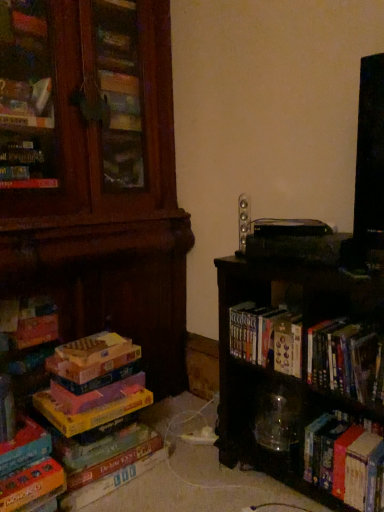
Question: Is black matte bookshelf at right positioned beyond the bounds of satin silver speaker at upper center?

Choices:
 (A) no
 (B) yes

Answer: (B)

Question: Is the position of black matte bookshelf at right less distant than that of satin silver speaker at upper center?

Choices:
 (A) no
 (B) yes

Answer: (B)

Question: Is black matte bookshelf at right facing towards satin silver speaker at upper center?

Choices:
 (A) yes
 (B) no

Answer: (B)

Question: From the image's perspective, does black matte bookshelf at right appear higher than satin silver speaker at upper center?

Choices:
 (A) no
 (B) yes

Answer: (A)

Question: Is black matte bookshelf at right oriented away from satin silver speaker at upper center?

Choices:
 (A) no
 (B) yes

Answer: (A)

Question: Is black matte bookshelf at right to the left of satin silver speaker at upper center from the viewer's perspective?

Choices:
 (A) yes
 (B) no

Answer: (B)

Question: Does hardcover books at center, arranged as the third book when viewed from the right, appear on the left side of hardcover book at lower right, positioned as the 1th book in right-to-left order?

Choices:
 (A) no
 (B) yes

Answer: (B)

Question: Considering the relative sizes of hardcover books at center, marked as the 3th book in a left-to-right arrangement, and hardcover book at lower right, positioned as the 1th book in right-to-left order, in the image provided, is hardcover books at center, marked as the 3th book in a left-to-right arrangement, wider than hardcover book at lower right, positioned as the 1th book in right-to-left order,?

Choices:
 (A) yes
 (B) no

Answer: (B)

Question: From the image's perspective, is hardcover books at center, arranged as the third book when viewed from the right, beneath hardcover book at lower right, the 5th book when ordered from left to right?

Choices:
 (A) no
 (B) yes

Answer: (A)

Question: From a real-world perspective, is hardcover books at center, marked as the 3th book in a left-to-right arrangement, located higher than hardcover book at lower right, the 5th book when ordered from left to right?

Choices:
 (A) no
 (B) yes

Answer: (B)

Question: Is hardcover books at center, arranged as the third book when viewed from the right, not inside hardcover book at lower right, positioned as the 1th book in right-to-left order?

Choices:
 (A) yes
 (B) no

Answer: (A)

Question: From the image's perspective, is hardcover books at center, marked as the 3th book in a left-to-right arrangement, over hardcover book at lower right, the 5th book when ordered from left to right?

Choices:
 (A) yes
 (B) no

Answer: (A)

Question: Does hardcover books at center, marked as the 3th book in a left-to-right arrangement, come in front of black matte bookshelf at right?

Choices:
 (A) no
 (B) yes

Answer: (A)